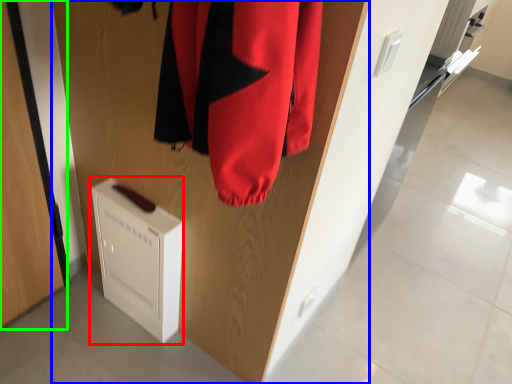
Question: Which object is the closest to the appliance (highlighted by a red box)? Choose among these: door (highlighted by a blue box) or door (highlighted by a green box).

Choices:
 (A) door
 (B) door

Answer: (A)